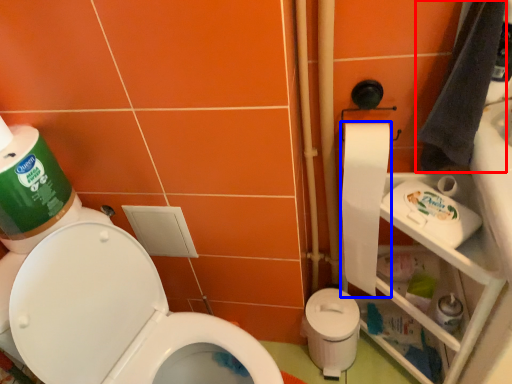
Question: Which object appears farthest to the camera in this image, hand towel (highlighted by a red box) or toilet paper (highlighted by a blue box)?

Choices:
 (A) hand towel
 (B) toilet paper

Answer: (B)